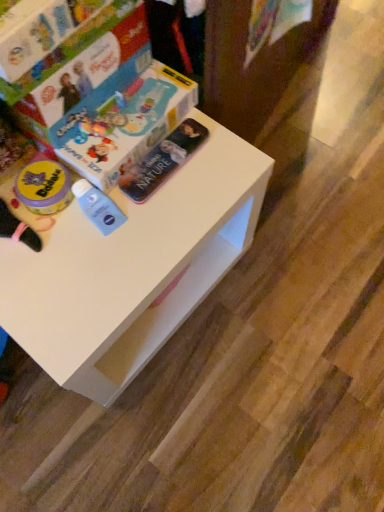
Where is `vacant area that is situated to the right of metallic silver book at center, marked as the 1th paperback book in a bottom-to-top arrangement`? Image resolution: width=384 pixels, height=512 pixels. vacant area that is situated to the right of metallic silver book at center, marked as the 1th paperback book in a bottom-to-top arrangement is located at coordinates (221, 168).